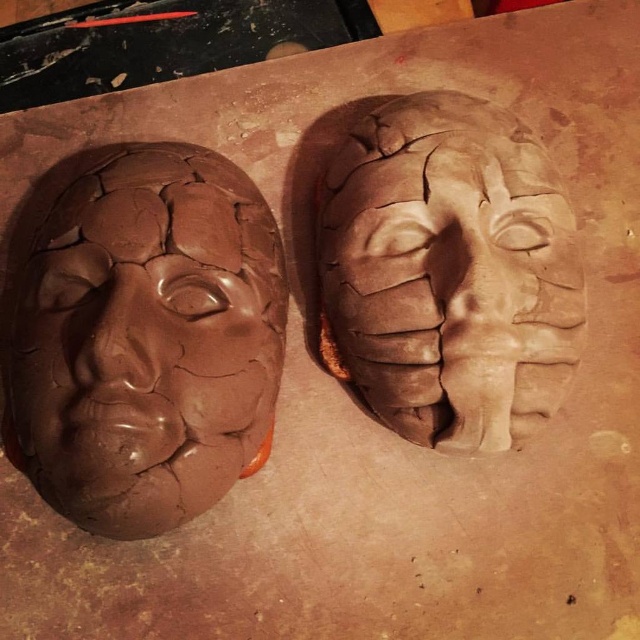
Question: Which point appears closest to the camera in this image?

Choices:
 (A) (332, 188)
 (B) (240, 244)

Answer: (B)

Question: Is matte clay mask at left positioned at the back of matte clay mask at center?

Choices:
 (A) no
 (B) yes

Answer: (A)

Question: Is matte clay mask at left below matte clay mask at center?

Choices:
 (A) no
 (B) yes

Answer: (B)

Question: Does matte clay mask at left have a smaller size compared to matte clay mask at center?

Choices:
 (A) yes
 (B) no

Answer: (B)